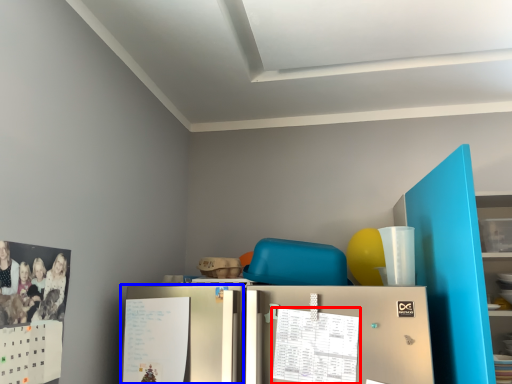
Question: Which object appears closest to the camera in this image, calendar (highlighted by a red box) or fridge (highlighted by a blue box)?

Choices:
 (A) calendar
 (B) fridge

Answer: (A)